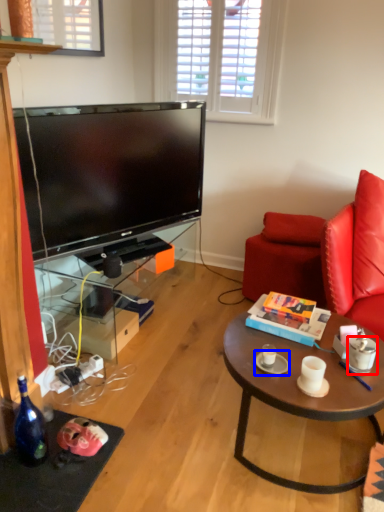
Question: Which object is further to the camera taking this photo, coffee cup (highlighted by a red box) or saucer (highlighted by a blue box)?

Choices:
 (A) coffee cup
 (B) saucer

Answer: (B)